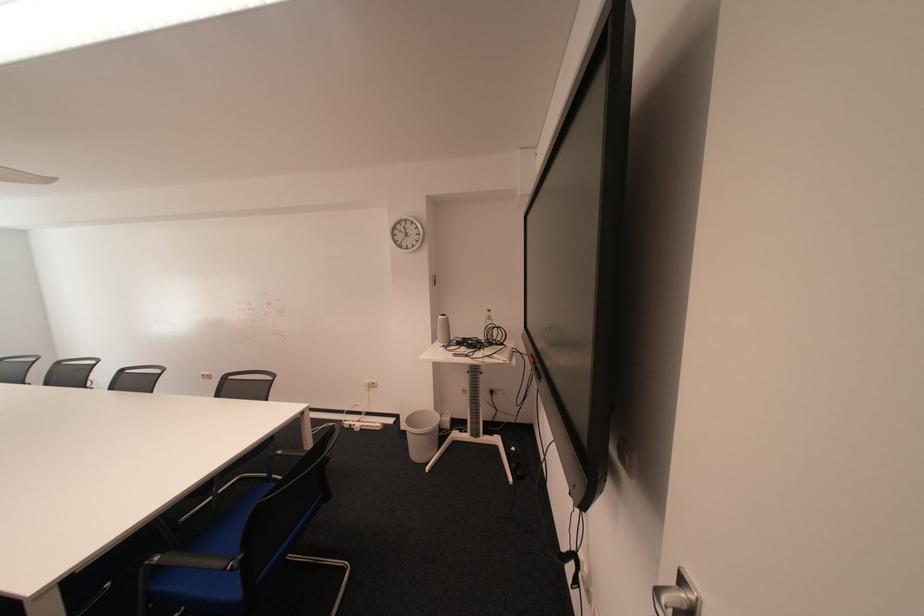
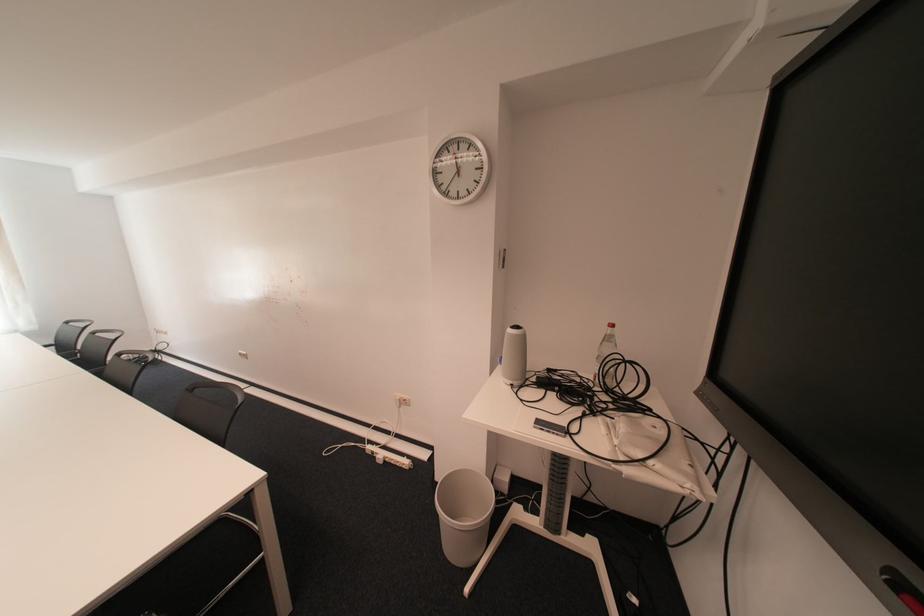
Question: The images are taken continuously from a first-person perspective. In which direction are you moving?

Choices:
 (A) Left
 (B) Right
 (C) Forward
 (D) Backward

Answer: (C)